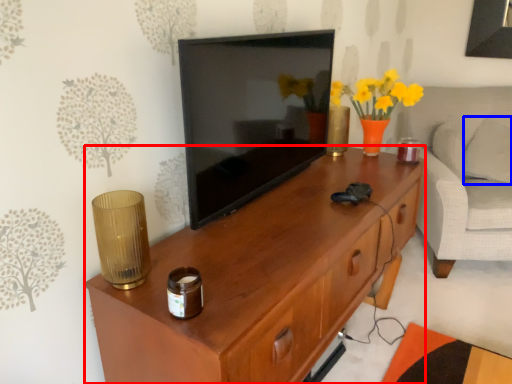
Question: Which object appears farthest to the camera in this image, desk (highlighted by a red box) or pillow (highlighted by a blue box)?

Choices:
 (A) desk
 (B) pillow

Answer: (B)